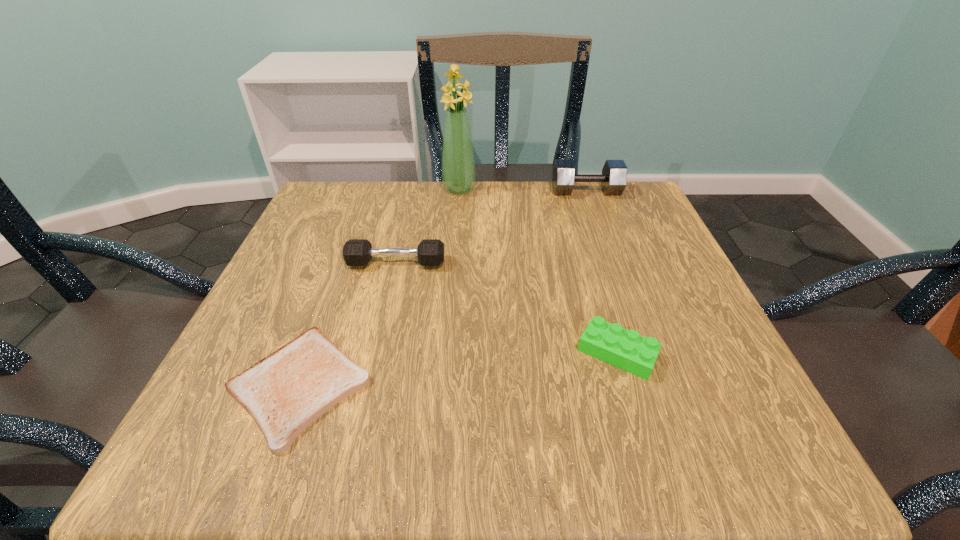
Locate an element on the screen. object positioned at the far right corner is located at coordinates (613, 179).

In the image, there is a desktop. Identify the location of free space at the far edge. The width and height of the screenshot is (960, 540). point(509,180).

Find the location of a particular element. This screenshot has height=540, width=960. blank area at the near edge is located at coordinates (626, 454).

The image size is (960, 540). I want to click on free region at the left edge of the desktop, so click(x=250, y=341).

In the image, there is a desktop. Identify the location of vacant space at the right edge. (623, 300).

This screenshot has height=540, width=960. Identify the location of vacant space at the far left corner of the desktop. (321, 232).

Locate an element on the screen. The image size is (960, 540). vacant space at the near left corner of the desktop is located at coordinates 219,437.

Locate an element on the screen. The height and width of the screenshot is (540, 960). vacant space at the far right corner of the desktop is located at coordinates (587, 195).

This screenshot has height=540, width=960. In order to click on free space between the shorter dumbbell and the tallest object in this screenshot , I will do `click(427, 226)`.

Locate an element on the screen. vacant region between the fourth shortest object and the third nearest object is located at coordinates (492, 227).